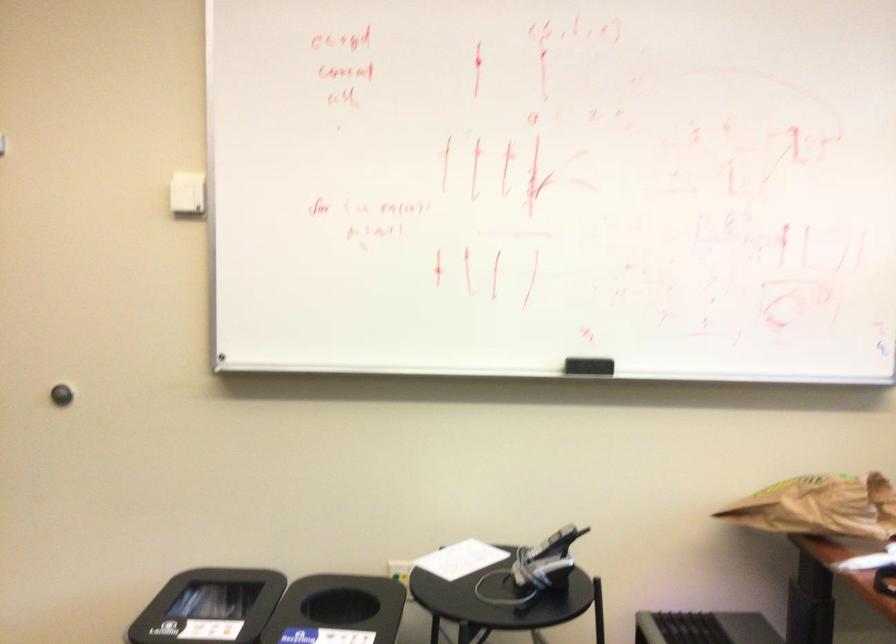
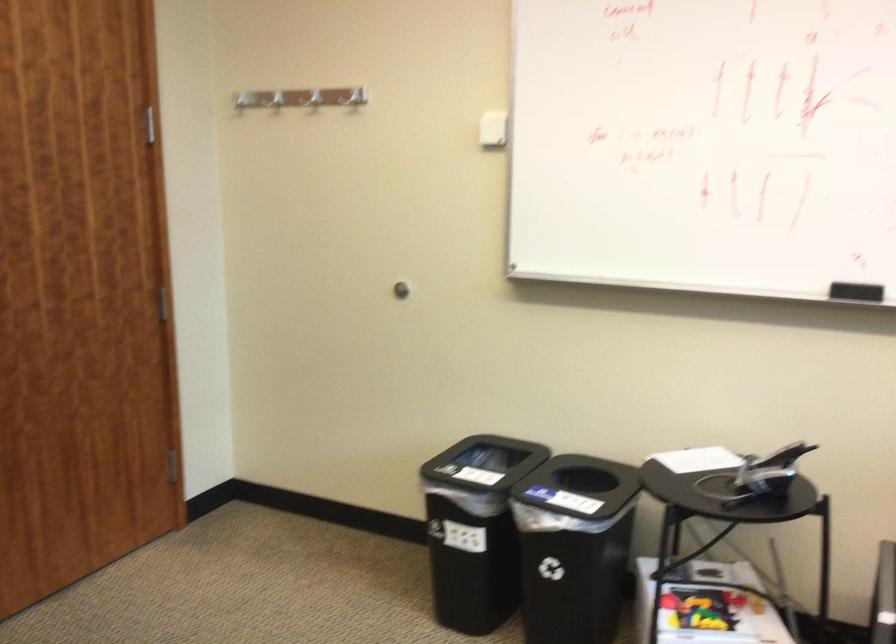
Question: How did the camera likely rotate?

Choices:
 (A) Left
 (B) Right
 (C) Up
 (D) Down

Answer: (A)